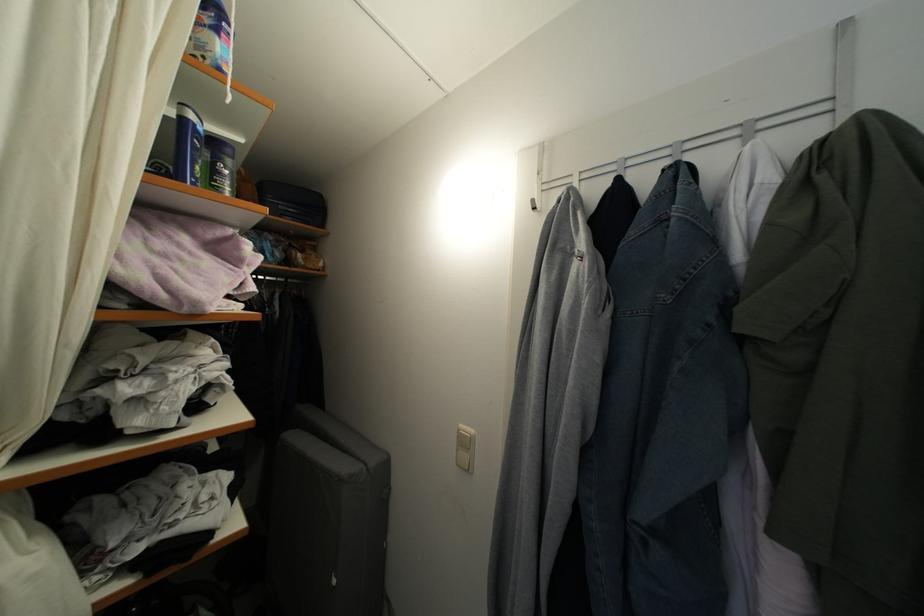
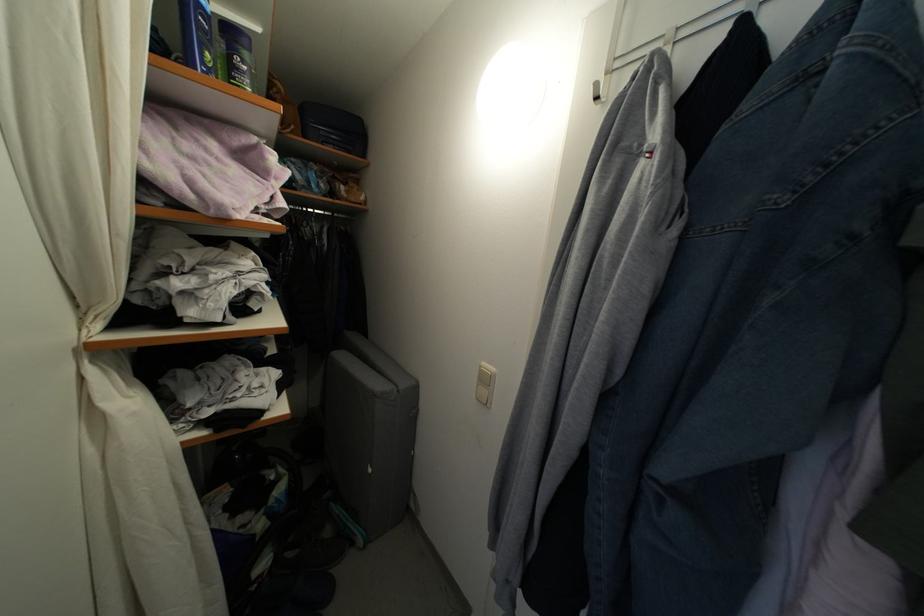
In the second image, find the point that corresponds to point (235, 168) in the first image.

(251, 61)